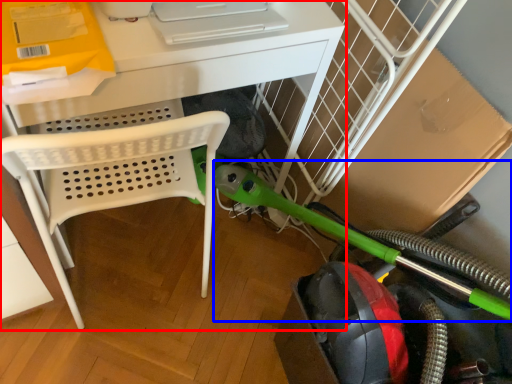
Question: Which object is further to the camera taking this photo, desk (highlighted by a red box) or garden hose (highlighted by a blue box)?

Choices:
 (A) desk
 (B) garden hose

Answer: (A)